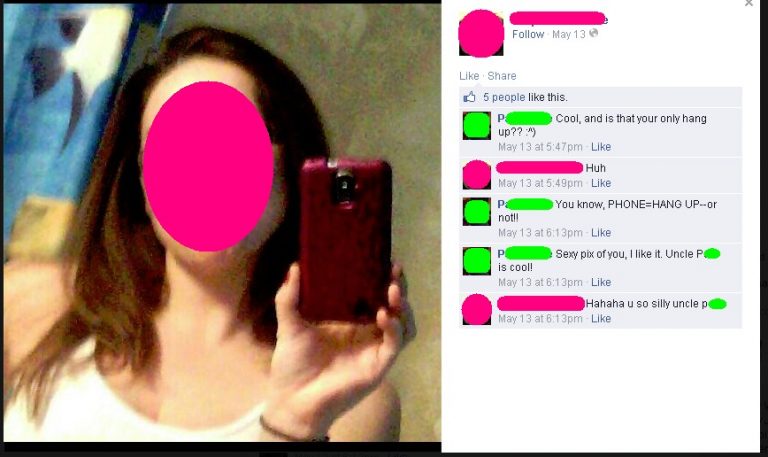
Identify the location of brown wall behind woman. (422, 413), (424, 250), (422, 65), (343, 124), (277, 20), (144, 35).